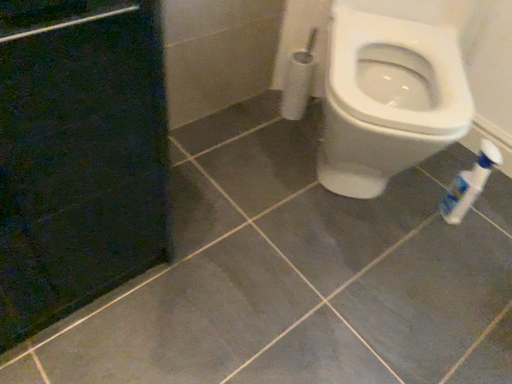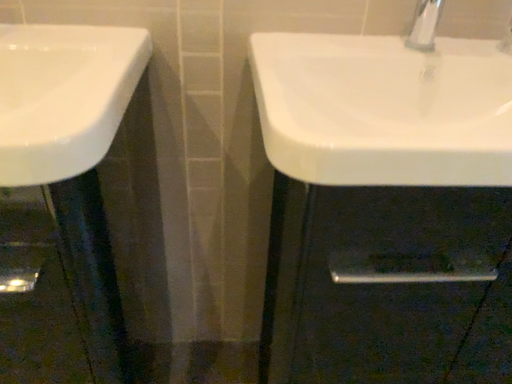
Question: Which way did the camera rotate in the video?

Choices:
 (A) rotated left
 (B) rotated right

Answer: (A)